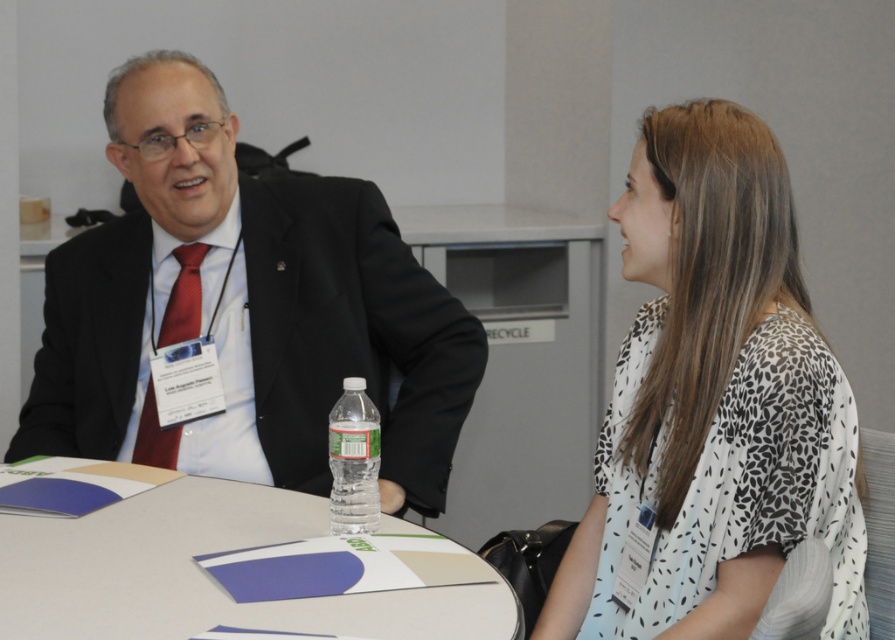
Question: Does matte black suit at center appear on the left side of white paper at center?

Choices:
 (A) no
 (B) yes

Answer: (B)

Question: Which of the following is the closest to the observer?

Choices:
 (A) white dotted blouse at center
 (B) clear plastic bottle at center
 (C) white paper at center

Answer: (C)

Question: Which object is positioned farthest from the clear plastic bottle at center?

Choices:
 (A) white dotted blouse at center
 (B) white paper at center

Answer: (A)

Question: Which point is farther to the camera?

Choices:
 (A) (x=495, y=609)
 (B) (x=362, y=378)
 (C) (x=744, y=122)
 (D) (x=348, y=209)

Answer: (D)

Question: Is matte black suit at center positioned before white dotted blouse at center?

Choices:
 (A) no
 (B) yes

Answer: (A)

Question: Can you confirm if white dotted blouse at center is bigger than clear plastic bottle at center?

Choices:
 (A) yes
 (B) no

Answer: (A)